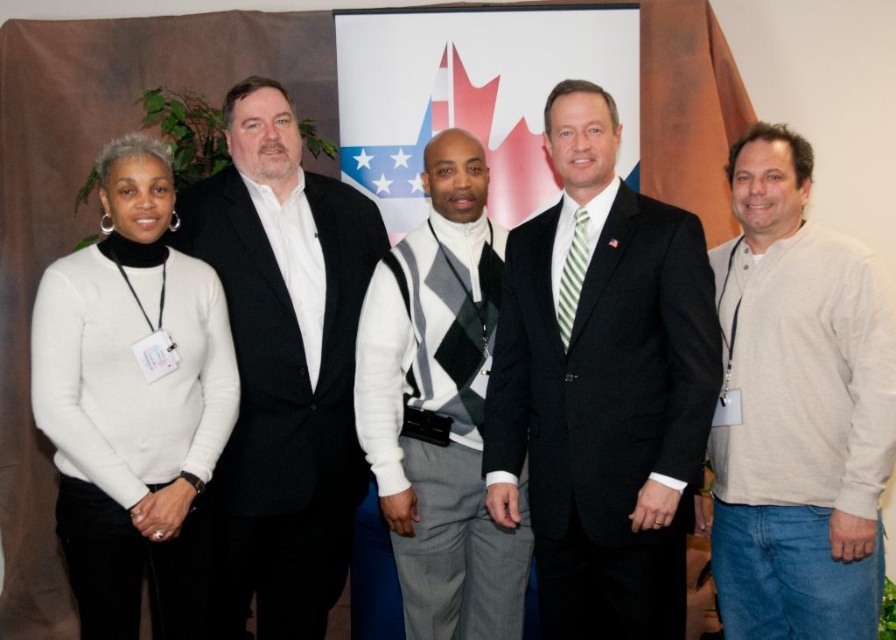
You are standing in front of the backdrop with the maple leaf and American flag. There are two points marked on the backdrop at coordinates point (199,436) and point (247,556). If you were to walk towards the backdrop, which point would you encounter first?

Point (199,436) is in front of point (247,556), so you would encounter point (199,436) first when walking towards the backdrop.